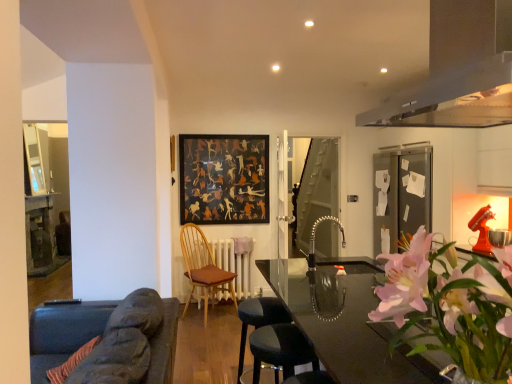
Where is `empty space that is ontop of dark gray fabric bar stool at center, positioned as the 1th bar stool in back-to-front order (from a real-world perspective)`? The image size is (512, 384). empty space that is ontop of dark gray fabric bar stool at center, positioned as the 1th bar stool in back-to-front order (from a real-world perspective) is located at coordinates (264, 303).